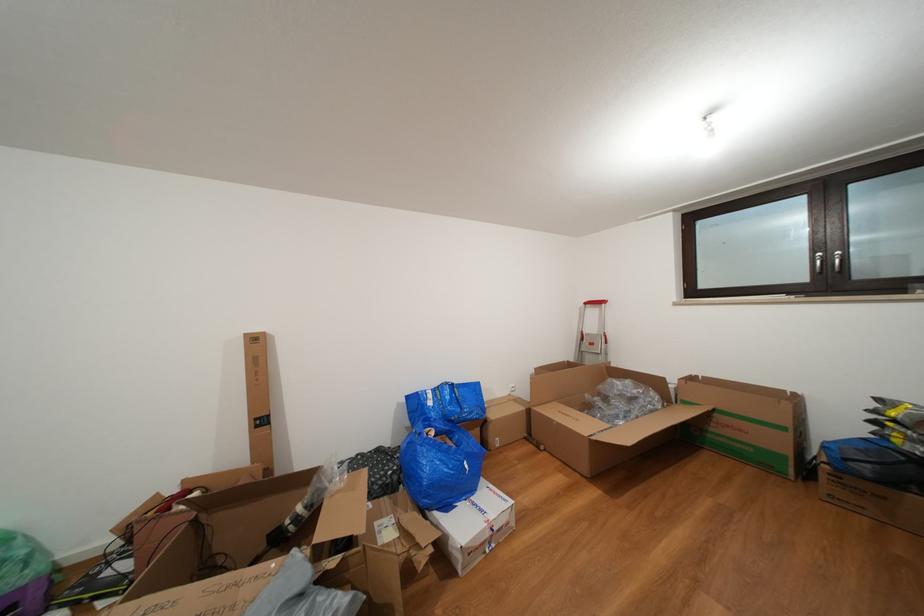
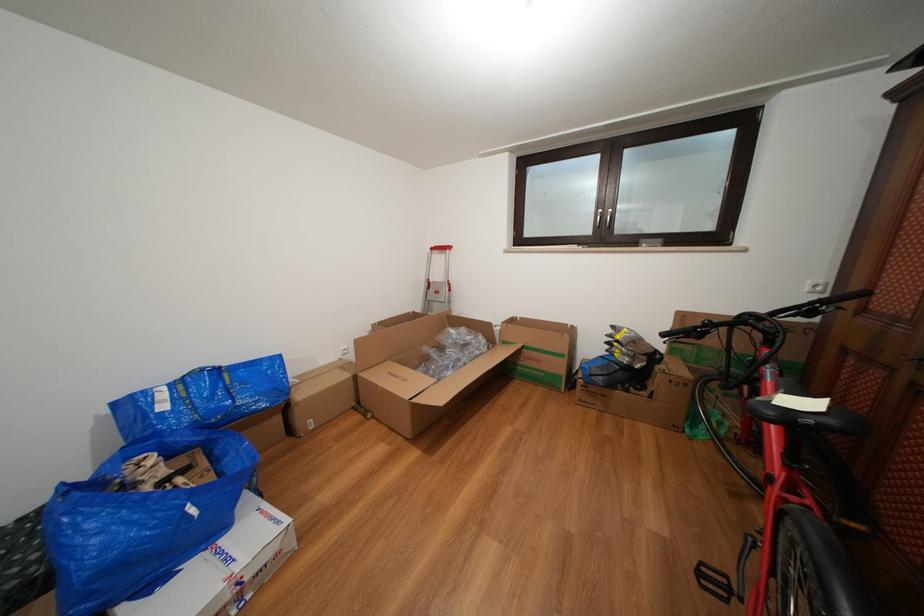
The point at (475,472) is marked in the first image. Where is the corresponding point in the second image?

(201, 516)